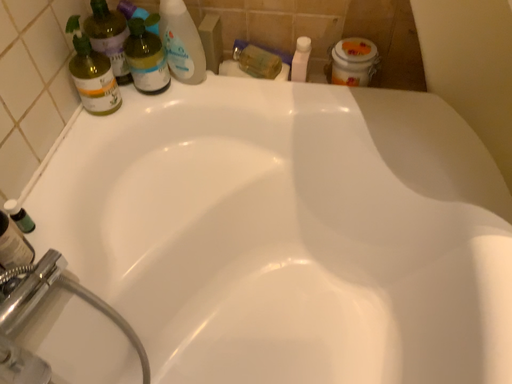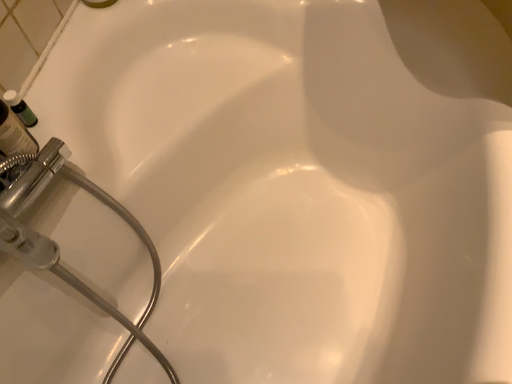
Question: Which way did the camera rotate in the video?

Choices:
 (A) rotated downward
 (B) rotated upward

Answer: (A)